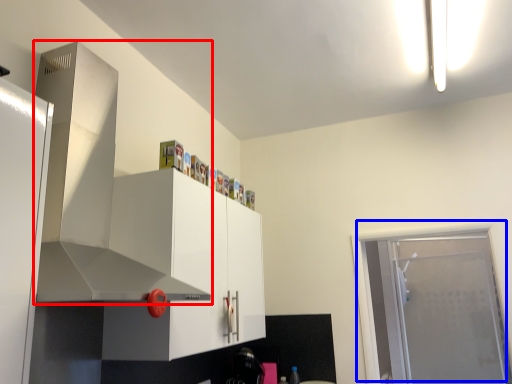
Question: Among these objects, which one is nearest to the camera, exhaust hood (highlighted by a red box) or door (highlighted by a blue box)?

Choices:
 (A) exhaust hood
 (B) door

Answer: (A)